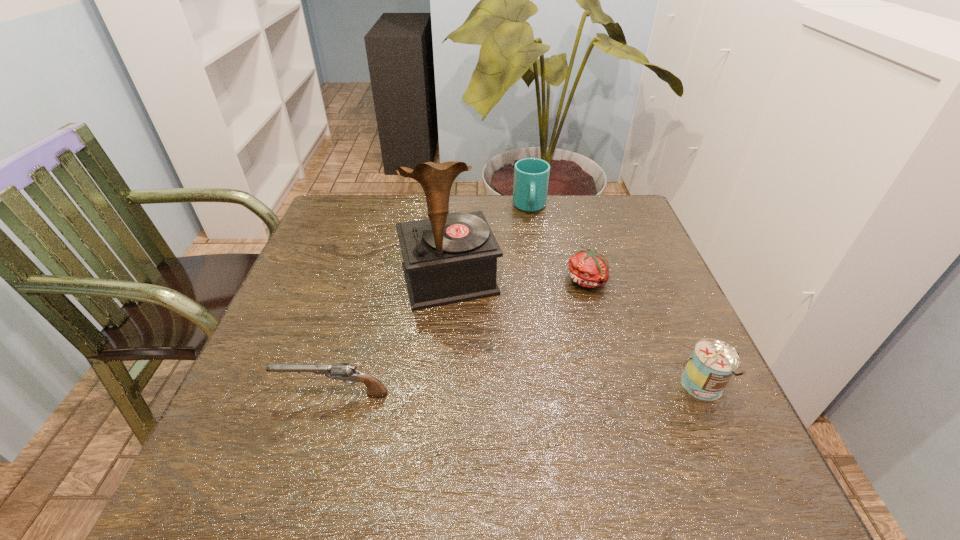
What are the coordinates of `free spot on the desktop that is between the gun and the rightmost object and is positioned on the front-facing side of the second object from right to left` in the screenshot? It's located at (561, 390).

Where is `free spot on the desktop that is between the gun and the can and is positioned on the handle side of the third object from right to left`? This screenshot has width=960, height=540. free spot on the desktop that is between the gun and the can and is positioned on the handle side of the third object from right to left is located at coordinates (547, 390).

Where is `vacant space on the desktop that is between the gun and the rightmost object and is positioned at the horn opening of the tallest object`? vacant space on the desktop that is between the gun and the rightmost object and is positioned at the horn opening of the tallest object is located at coordinates (486, 391).